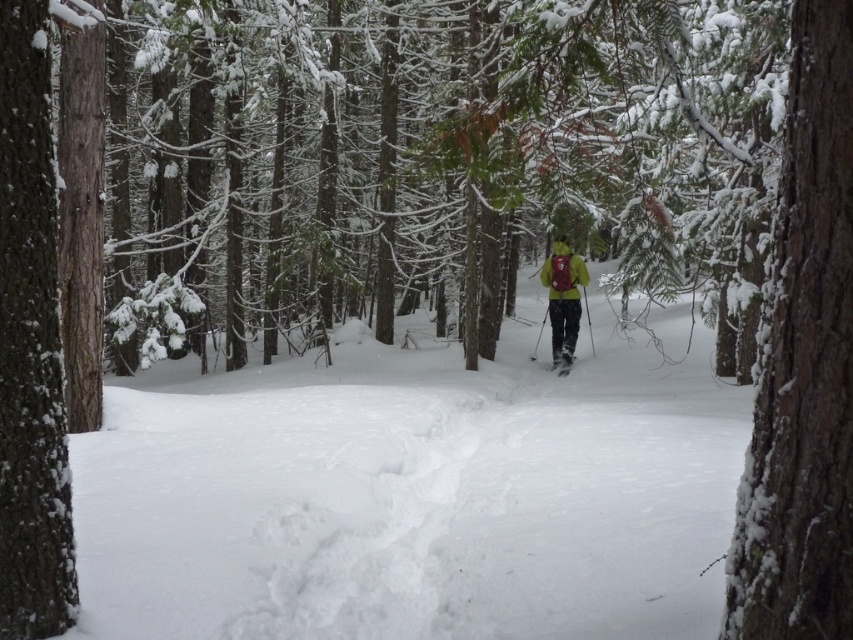
Question: Is white fluffy snow at center to the left of green matte jacket at center from the viewer's perspective?

Choices:
 (A) no
 (B) yes

Answer: (B)

Question: Among these objects, which one is farthest from the camera?

Choices:
 (A) snow-covered bark at right
 (B) white fluffy snow at center
 (C) matte yellow ski at center

Answer: (C)

Question: Which point is closer to the camera taking this photo?

Choices:
 (A) (814, 90)
 (B) (543, 262)

Answer: (A)

Question: Does snow-covered tree trunk at left have a smaller size compared to matte yellow ski at center?

Choices:
 (A) yes
 (B) no

Answer: (B)

Question: Which point is farther to the camera?

Choices:
 (A) (665, 444)
 (B) (28, 461)
 (C) (809, 442)

Answer: (A)

Question: Can you confirm if white fluffy snow at center is bigger than snow-covered bark at right?

Choices:
 (A) no
 (B) yes

Answer: (B)